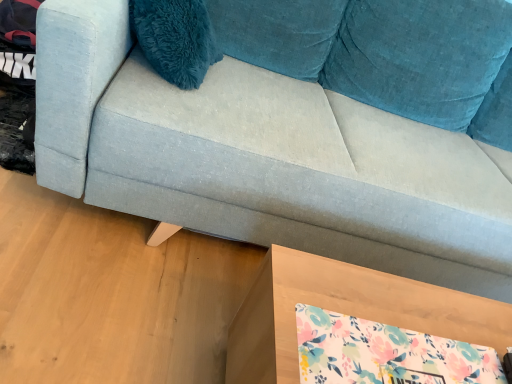
What do you see at coordinates (264, 159) in the screenshot?
I see `light blue fabric couch at center` at bounding box center [264, 159].

This screenshot has width=512, height=384. What are the coordinates of `light blue fabric couch at center` in the screenshot? It's located at [x=264, y=159].

What do you see at coordinates (346, 311) in the screenshot? This screenshot has height=384, width=512. I see `wooden table at lower right` at bounding box center [346, 311].

Where is `wooden table at lower right`? wooden table at lower right is located at coordinates (346, 311).

Find the location of `light blue fabric couch at center`. light blue fabric couch at center is located at coordinates (264, 159).

Can you confirm if light blue fabric couch at center is positioned to the right of wooden table at lower right?

Correct, you'll find light blue fabric couch at center to the right of wooden table at lower right.

Considering the positions of objects light blue fabric couch at center and wooden table at lower right in the image provided, who is behind, light blue fabric couch at center or wooden table at lower right?

wooden table at lower right.

Which is in front, point (82, 64) or point (378, 286)?

The point (82, 64) is closer to the camera.

From the image's perspective, between light blue fabric couch at center and wooden table at lower right, which one is located above?

light blue fabric couch at center is shown above in the image.

From a real-world perspective, between light blue fabric couch at center and wooden table at lower right, who is vertically lower?

In real-world perspective, wooden table at lower right is lower.

Can you confirm if light blue fabric couch at center is wider than wooden table at lower right?

Indeed, light blue fabric couch at center has a greater width compared to wooden table at lower right.

In terms of height, does light blue fabric couch at center look taller or shorter compared to wooden table at lower right?

light blue fabric couch at center is taller than wooden table at lower right.

Does light blue fabric couch at center have a larger size compared to wooden table at lower right?

Correct, light blue fabric couch at center is larger in size than wooden table at lower right.

Consider the image. Is wooden table at lower right a part of light blue fabric couch at center?

Definitely not — wooden table at lower right is not inside light blue fabric couch at center.

Is light blue fabric couch at center positioned far away from wooden table at lower right?

light blue fabric couch at center is actually quite close to wooden table at lower right.

Is light blue fabric couch at center looking in the opposite direction of wooden table at lower right?

No.

At what (x,y) coordinates should I click in order to perform the action: click on table that is below the light blue fabric couch at center (from the image's perspective). Please return your answer as a coordinate pair (x, y). The height and width of the screenshot is (384, 512). Looking at the image, I should click on (346, 311).

Can you confirm if wooden table at lower right is positioned to the right of light blue fabric couch at center?

Incorrect, wooden table at lower right is not on the right side of light blue fabric couch at center.

Looking at this image, is wooden table at lower right in front of or behind light blue fabric couch at center in the image?

Clearly, wooden table at lower right is behind light blue fabric couch at center.

Does point (449, 295) lie behind point (394, 169)?

No, it is not.

From the image's perspective, is wooden table at lower right located above light blue fabric couch at center?

No.

From a real-world perspective, who is located higher, wooden table at lower right or light blue fabric couch at center?

light blue fabric couch at center is physically above.

Which object is wider, wooden table at lower right or light blue fabric couch at center?

light blue fabric couch at center.

Which of these two, wooden table at lower right or light blue fabric couch at center, stands taller?

light blue fabric couch at center.

Does wooden table at lower right have a smaller size compared to light blue fabric couch at center?

Correct, wooden table at lower right occupies less space than light blue fabric couch at center.

Would you say wooden table at lower right contains light blue fabric couch at center?

No, light blue fabric couch at center is located outside of wooden table at lower right.

From the picture: Are wooden table at lower right and light blue fabric couch at center beside each other?

No, wooden table at lower right is not with light blue fabric couch at center.

Does wooden table at lower right turn towards light blue fabric couch at center?

No, wooden table at lower right is not turned towards light blue fabric couch at center.

Measure the distance between wooden table at lower right and light blue fabric couch at center.

The distance of wooden table at lower right from light blue fabric couch at center is 16.22 inches.

Image resolution: width=512 pixels, height=384 pixels. What are the coordinates of `studio couch above the wooden table at lower right (from the image's perspective)` in the screenshot? It's located at (264, 159).

Where is `studio couch on the right of wooden table at lower right`? The width and height of the screenshot is (512, 384). studio couch on the right of wooden table at lower right is located at coordinates (264, 159).

The height and width of the screenshot is (384, 512). In order to click on studio couch in front of the wooden table at lower right in this screenshot , I will do `click(264, 159)`.